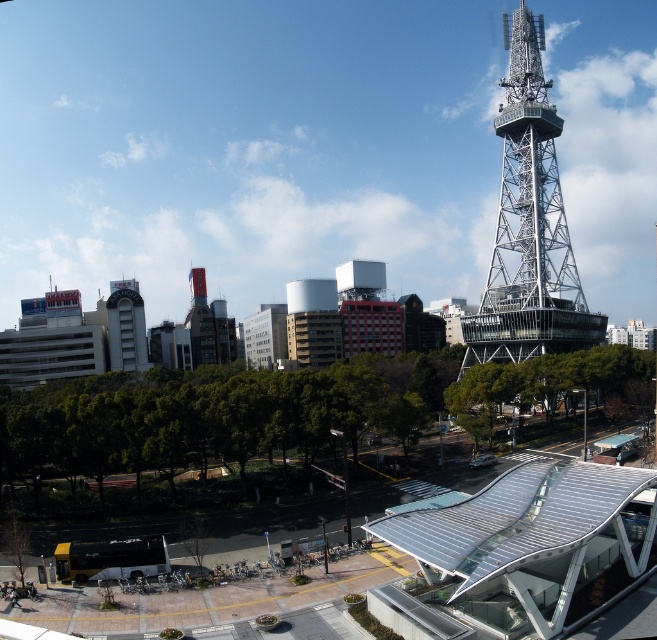
Is metallic lattice tower at upper right closer to the viewer compared to white concrete building at left?

Yes, metallic lattice tower at upper right is closer to the viewer.

Looking at this image, can you confirm if metallic lattice tower at upper right is bigger than white concrete building at left?

Yes.

Between point (537, 236) and point (120, 316), which one is positioned in front?

Positioned in front is point (537, 236).

This screenshot has width=657, height=640. I want to click on metallic lattice tower at upper right, so click(528, 225).